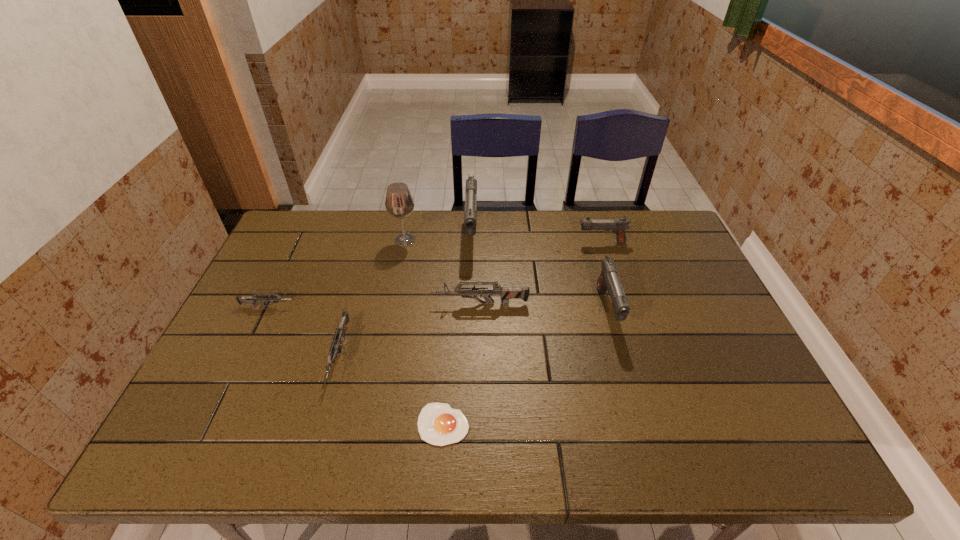
At what (x,y) coordinates should I click in order to perform the action: click on wineglass. Please return your answer as a coordinate pair (x, y). Image resolution: width=960 pixels, height=540 pixels. Looking at the image, I should click on (399, 203).

At what (x,y) coordinates should I click in order to perform the action: click on the leftmost gray gun. Please return your answer as a coordinate pair (x, y). Looking at the image, I should click on (470, 214).

What are the coordinates of `the biggest gray gun` in the screenshot? It's located at (470, 214).

Find the location of `the fifth shortest gun`. the fifth shortest gun is located at coordinates (608, 280).

Identify the location of the sixth shortest object. This screenshot has height=540, width=960. (608, 280).

Where is `the fourth shortest gun`? the fourth shortest gun is located at coordinates (619, 226).

Where is `the fifth shortest object`? This screenshot has width=960, height=540. the fifth shortest object is located at coordinates (619, 226).

In order to click on the rightmost grey gun in this screenshot , I will do `click(505, 293)`.

The width and height of the screenshot is (960, 540). In order to click on the biggest grey gun in this screenshot , I will do `click(505, 293)`.

You are a GUI agent. You are given a task and a screenshot of the screen. Output one action in this format:
    pyautogui.click(x=<x>, y=<y>)
    Task: Click on the nearest grey gun
    This screenshot has height=540, width=960.
    Given the screenshot: What is the action you would take?
    pos(339,334)